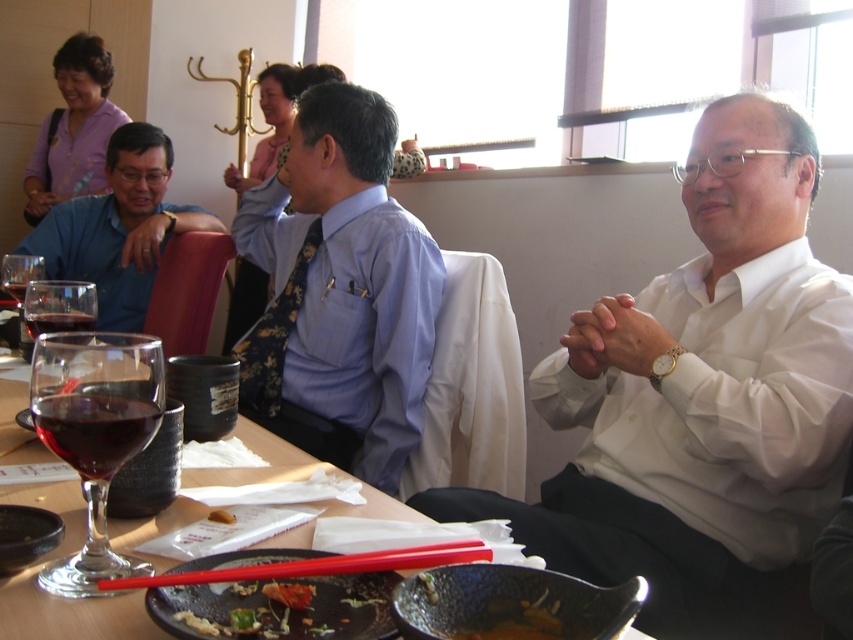
Who is higher up, ruby glass at table center or ruby glass at center?

Positioned higher is ruby glass at center.

Find the location of `ruby glass at table center`. ruby glass at table center is located at coordinates (96, 429).

Does greasy black plate at lower center have a greater height compared to floral silk tie at center?

In fact, greasy black plate at lower center may be shorter than floral silk tie at center.

Which is in front, point (373, 616) or point (277, 406)?

Positioned in front is point (373, 616).

At what (x,y) coordinates should I click in order to perform the action: click on greasy black plate at lower center. Please return your answer as a coordinate pair (x, y). The height and width of the screenshot is (640, 853). Looking at the image, I should click on (287, 609).

Can you confirm if floral silk tie at center is smaller than ruby glass at center?

Incorrect, floral silk tie at center is not smaller in size than ruby glass at center.

Does floral silk tie at center have a lesser height compared to ruby glass at center?

No, floral silk tie at center is not shorter than ruby glass at center.

Identify the location of floral silk tie at center. The image size is (853, 640). click(273, 337).